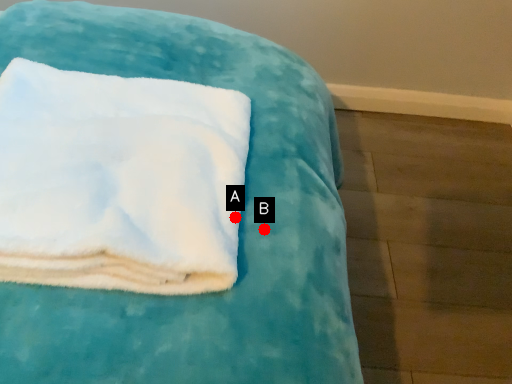
Question: Two points are circled on the image, labeled by A and B beside each circle. Among these points, which one is farthest from the camera?

Choices:
 (A) A is further
 (B) B is further

Answer: (B)